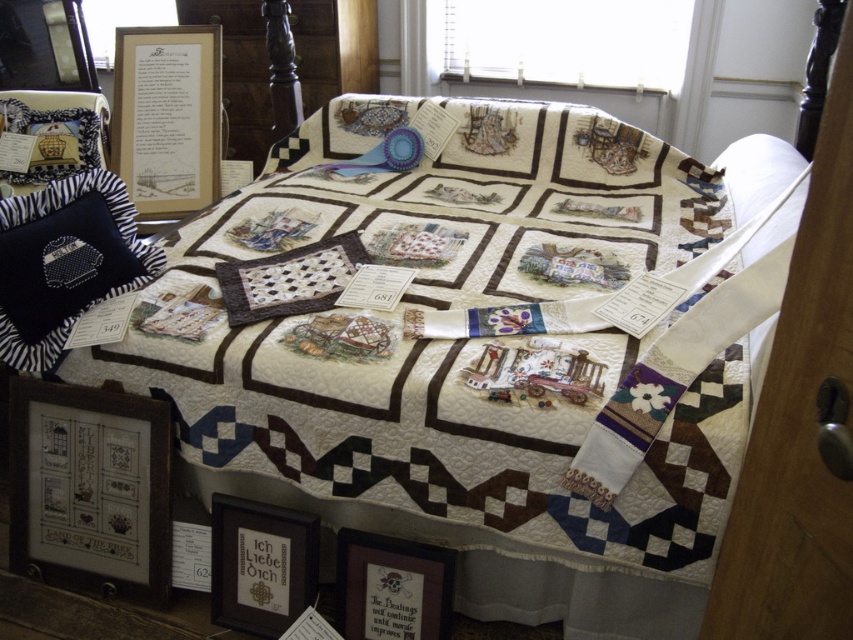
Question: Among these points, which one is farthest from the camera?

Choices:
 (A) (354, 616)
 (B) (260, 579)
 (C) (80, 502)

Answer: (C)

Question: Which point is farther from the camera taking this photo?

Choices:
 (A) (305, 586)
 (B) (138, 488)
 (C) (387, 566)
 (D) (206, 42)

Answer: (D)

Question: Can you confirm if matte gold picture frame at upper left is positioned above wooden framed sign at lower center?

Choices:
 (A) no
 (B) yes

Answer: (B)

Question: Based on their relative distances, which object is nearer to the matte black picture frame at lower center?

Choices:
 (A) matte gold picture frame at upper left
 (B) wooden framed sign at lower center
 (C) wooden framed picture at lower left

Answer: (B)

Question: Can you confirm if matte gold picture frame at upper left is positioned below matte black picture frame at lower center?

Choices:
 (A) yes
 (B) no

Answer: (B)

Question: Does matte black picture frame at lower center appear over wooden framed sign at lower center?

Choices:
 (A) no
 (B) yes

Answer: (B)